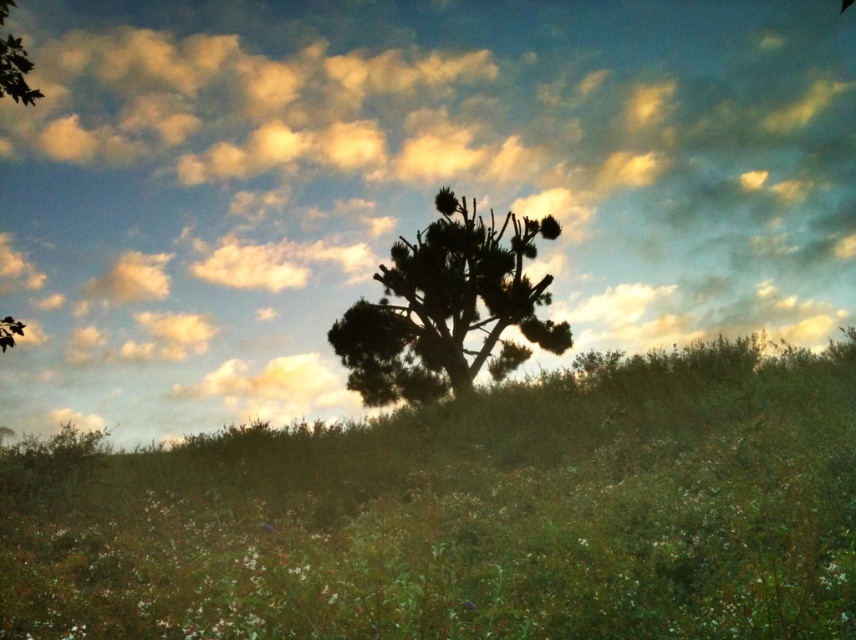
You are a photographer holding a camera at eye level. You want to capture a closeup of the cloudy sky at upper center. Considering the distance is 8.44 meters, will you need a telephoto lens to get a clear closeup shot?

The cloudy sky at upper center is 8.44 meters away. A telephoto lens is required to capture a clear closeup from that distance.